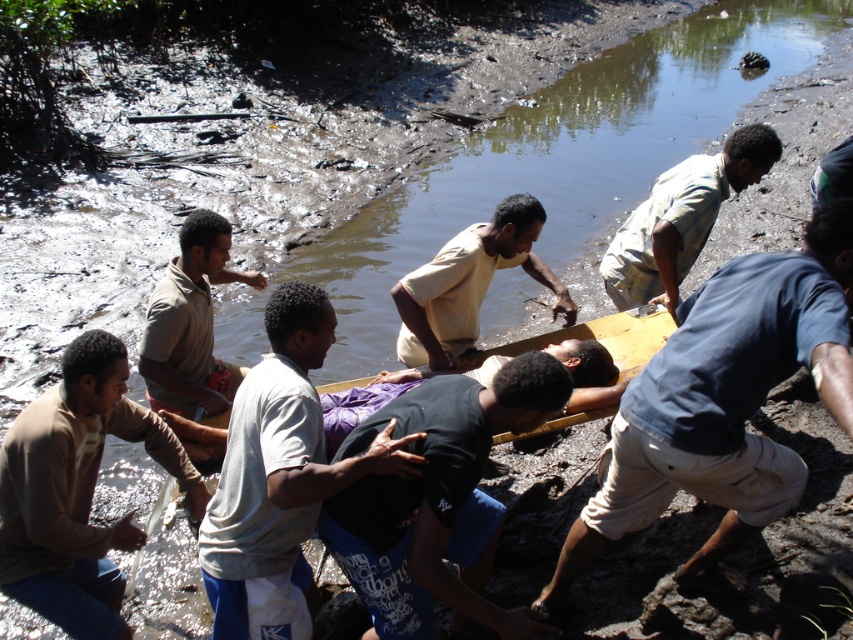
Who is taller, blue cotton shirt at right or light beige shirt at center?

Standing taller between the two is blue cotton shirt at right.

Which is behind, point (753, 326) or point (566, 288)?

Positioned behind is point (566, 288).

Which is in front, point (807, 344) or point (456, 339)?

Point (807, 344) is in front.

At what (x,y) coordinates should I click in order to perform the action: click on blue cotton shirt at right. Please return your answer as a coordinate pair (x, y). This screenshot has width=853, height=640. Looking at the image, I should click on (724, 401).

Between point (524, 620) and point (637, 214), which one is positioned in front?

Point (524, 620) is more forward.

Which is more to the right, black matte shirt at center or light blue plaid shirt at upper right?

From the viewer's perspective, light blue plaid shirt at upper right appears more on the right side.

Who is more forward, (521, 385) or (727, 163)?

Point (521, 385) is in front.

The height and width of the screenshot is (640, 853). I want to click on black matte shirt at center, so [437, 500].

What do you see at coordinates (76, 490) in the screenshot? I see `brown matte shirt at lower left` at bounding box center [76, 490].

Can you confirm if brown matte shirt at lower left is taller than light blue plaid shirt at upper right?

Indeed, brown matte shirt at lower left has a greater height compared to light blue plaid shirt at upper right.

Which is behind, point (16, 512) or point (654, 186)?

Positioned behind is point (654, 186).

You are a GUI agent. You are given a task and a screenshot of the screen. Output one action in this format:
    pyautogui.click(x=<x>, y=<y>)
    Task: Click on the brown matte shirt at lower left
    
    Given the screenshot: What is the action you would take?
    pyautogui.click(x=76, y=490)